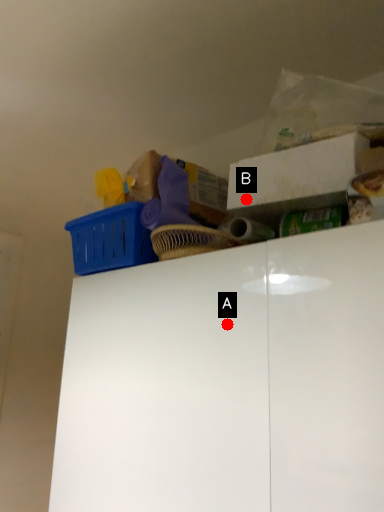
Question: Two points are circled on the image, labeled by A and B beside each circle. Among these points, which one is farthest from the camera?

Choices:
 (A) A is further
 (B) B is further

Answer: (B)